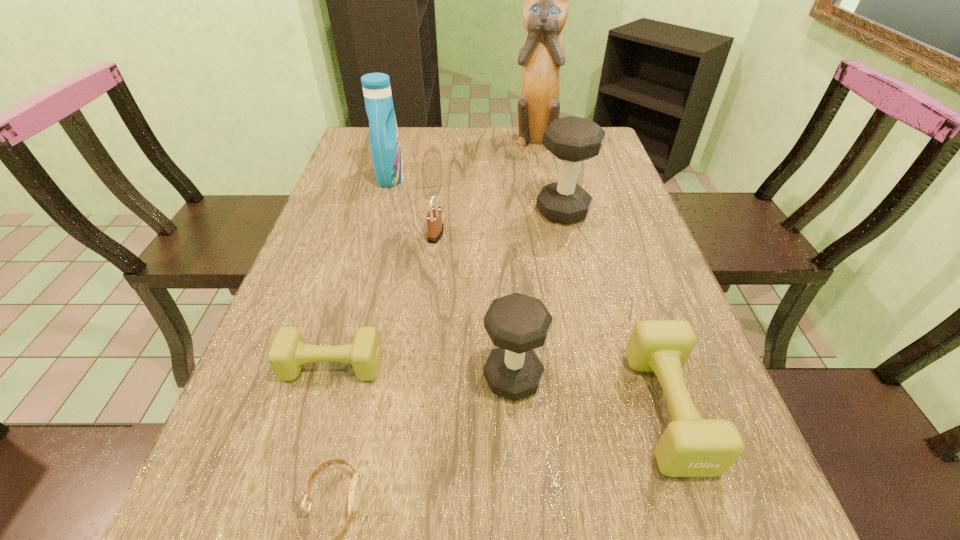
What are the coordinates of `empty location between the tallest object and the bigger olive dumbbell` in the screenshot? It's located at (601, 274).

Locate an element on the screen. The width and height of the screenshot is (960, 540). vacant point located between the second farthest object and the tallest dumbbell is located at coordinates (476, 194).

Where is `free point between the bigger gray dumbbell and the farthest object`? free point between the bigger gray dumbbell and the farthest object is located at coordinates coord(548,176).

The height and width of the screenshot is (540, 960). What are the coordinates of `object that is the seventh closest to the tallest object` in the screenshot? It's located at (355, 490).

Locate which object ranks fifth in proximity to the beige watch. Please provide its 2D coordinates. Your answer should be formatted as a tuple, i.e. [(x, y)], where the tuple contains the x and y coordinates of a point satisfying the conditions above.

[(571, 139)]

Identify the location of the third closest dumbbell to the second farthest object. The height and width of the screenshot is (540, 960). point(516,323).

Select which dumbbell is the closest to the padlock. Please provide its 2D coordinates. Your answer should be formatted as a tuple, i.e. [(x, y)], where the tuple contains the x and y coordinates of a point satisfying the conditions above.

[(571, 139)]

The width and height of the screenshot is (960, 540). What are the coordinates of `blank space that satisfies the following two spatial constraints: 1. on the face of the second shortest dumbbell; 2. on the right side of the tallest object` in the screenshot? It's located at (585, 409).